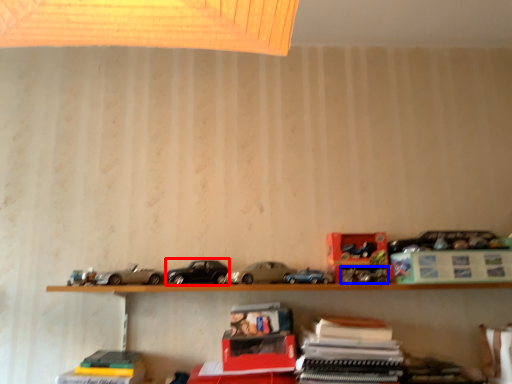
Question: Which object appears farthest to the camera in this image, car (highlighted by a red box) or toy (highlighted by a blue box)?

Choices:
 (A) car
 (B) toy

Answer: (B)